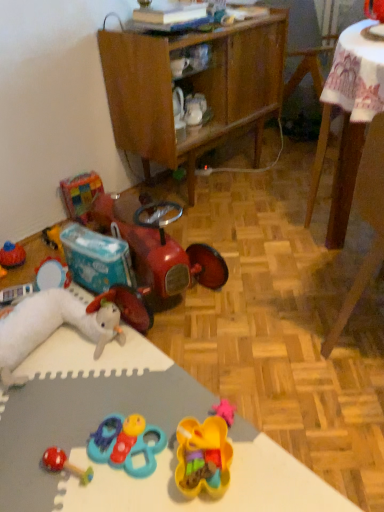
What are the coordinates of `vacant space to the right of plastic toy at center` in the screenshot? It's located at (278, 351).